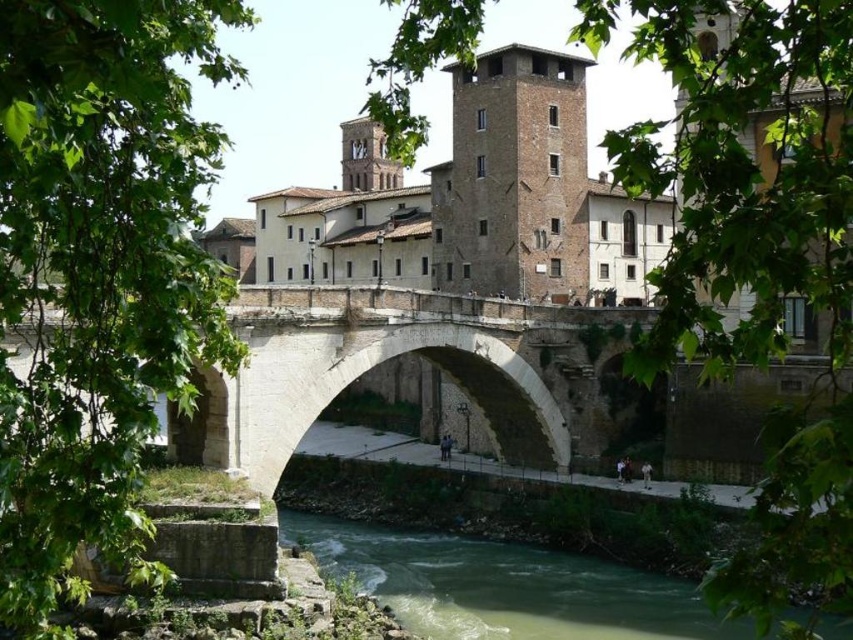
Is brown rough stone tower at center smaller than green stone water at lower center?

Incorrect, brown rough stone tower at center is not smaller in size than green stone water at lower center.

Does brown rough stone tower at center appear under green stone water at lower center?

Incorrect, brown rough stone tower at center is not positioned below green stone water at lower center.

Where is `brown rough stone tower at center`? This screenshot has height=640, width=853. brown rough stone tower at center is located at coordinates (514, 179).

Which of these two, green stone water at lower center or brown stone tower at upper center, stands taller?

brown stone tower at upper center is taller.

Is point (605, 566) farther from camera compared to point (364, 180)?

No, it is in front of (364, 180).

Where is `green stone water at lower center`? This screenshot has width=853, height=640. green stone water at lower center is located at coordinates (503, 586).

Is brown rough stone tower at center closer to the viewer compared to brown stone tower at upper center?

Yes, it is in front of brown stone tower at upper center.

Does brown rough stone tower at center appear on the right side of brown stone tower at upper center?

Indeed, brown rough stone tower at center is positioned on the right side of brown stone tower at upper center.

Is point (445, 67) positioned in front of point (381, 154)?

That is True.

This screenshot has width=853, height=640. In order to click on brown rough stone tower at center in this screenshot , I will do `click(514, 179)`.